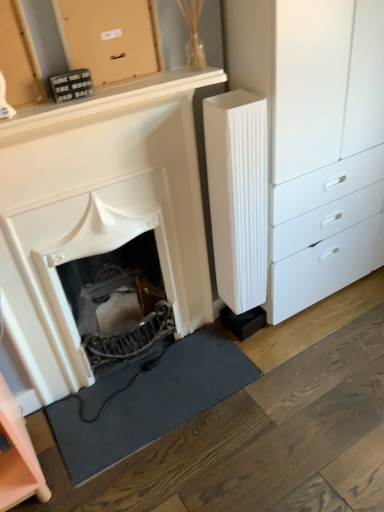
The height and width of the screenshot is (512, 384). I want to click on free spot to the right of wooden board at upper center, arranged as the first cabinetry when viewed from the top, so click(153, 77).